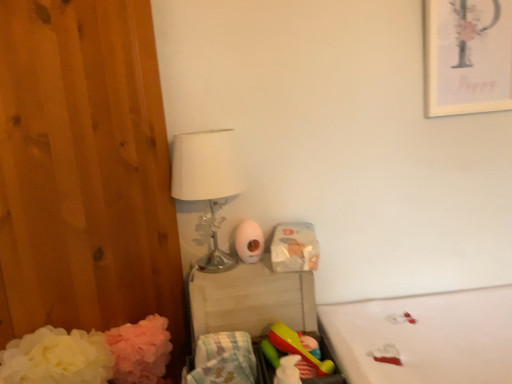
At what (x,y) coordinates should I click in order to perform the action: click on vacant space positioned to the left of white glossy toilet paper at center. Please return your answer as a coordinate pair (x, y). The image size is (512, 384). Looking at the image, I should click on (208, 266).